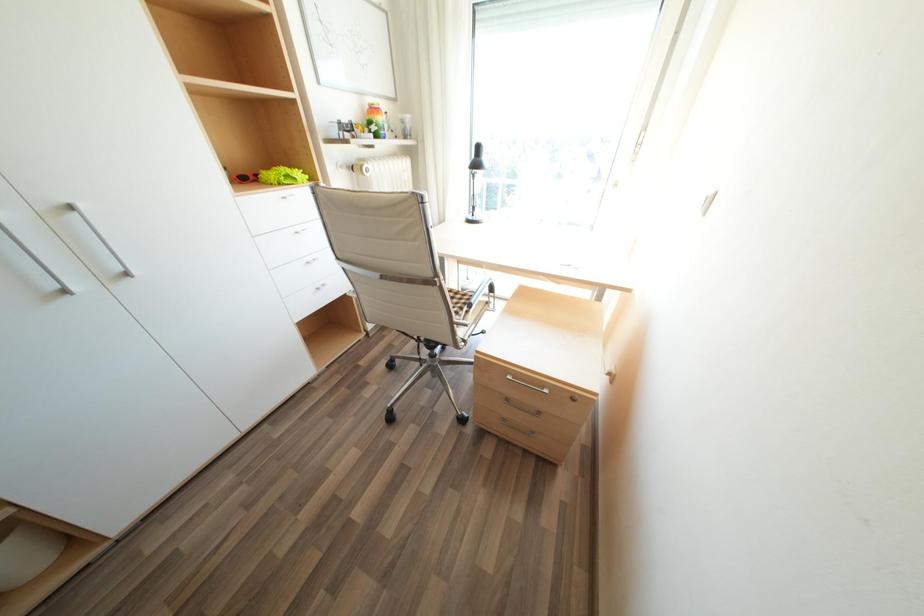
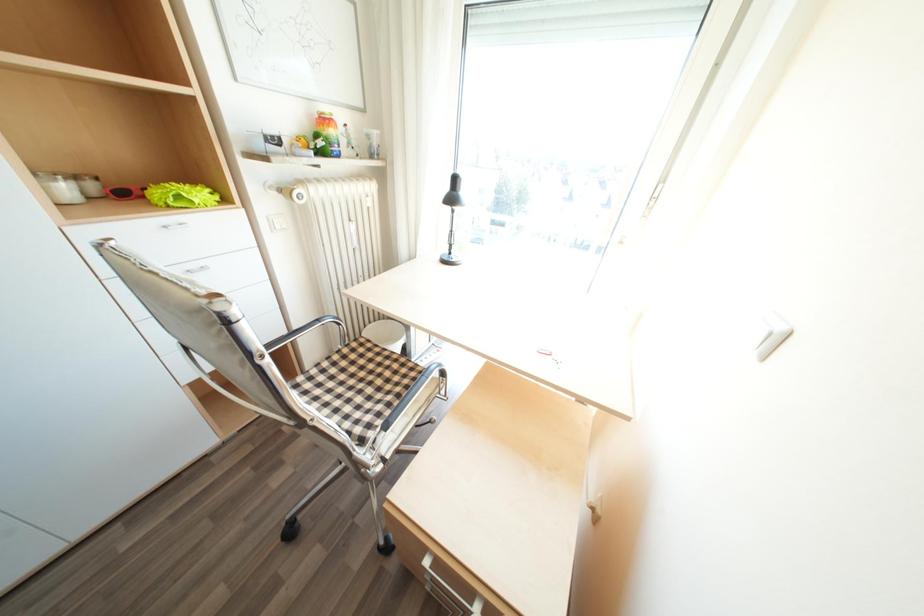
Question: Based on the continuous images, in which direction is the camera rotating? Reply with the corresponding letter.

Choices:
 (A) Left
 (B) Right
 (C) Up
 (D) Down

Answer: (C)